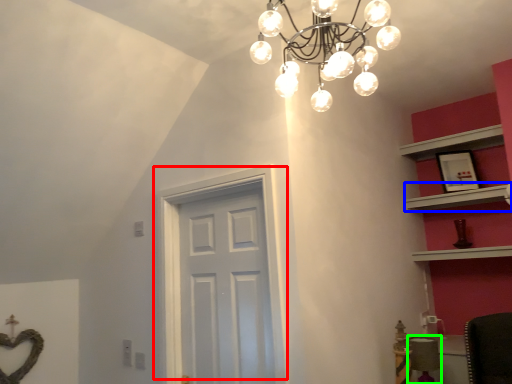
Question: Based on their relative distances, which object is nearer to door (highlighted by a red box)? Choose from shelf (highlighted by a blue box) and chair (highlighted by a green box).

Choices:
 (A) shelf
 (B) chair

Answer: (B)